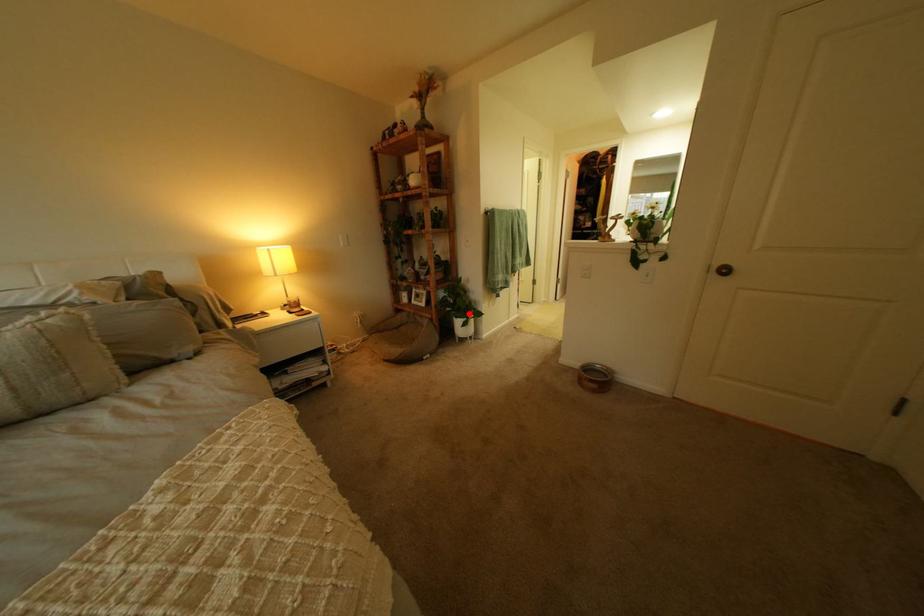
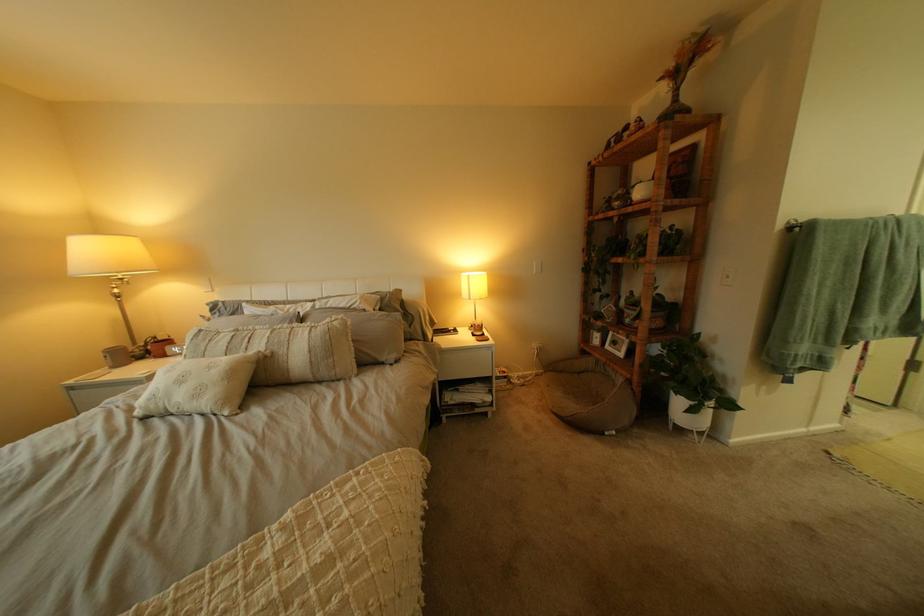
Where in the second image is the point corresponding to the highlighted location from the first image?

(687, 385)